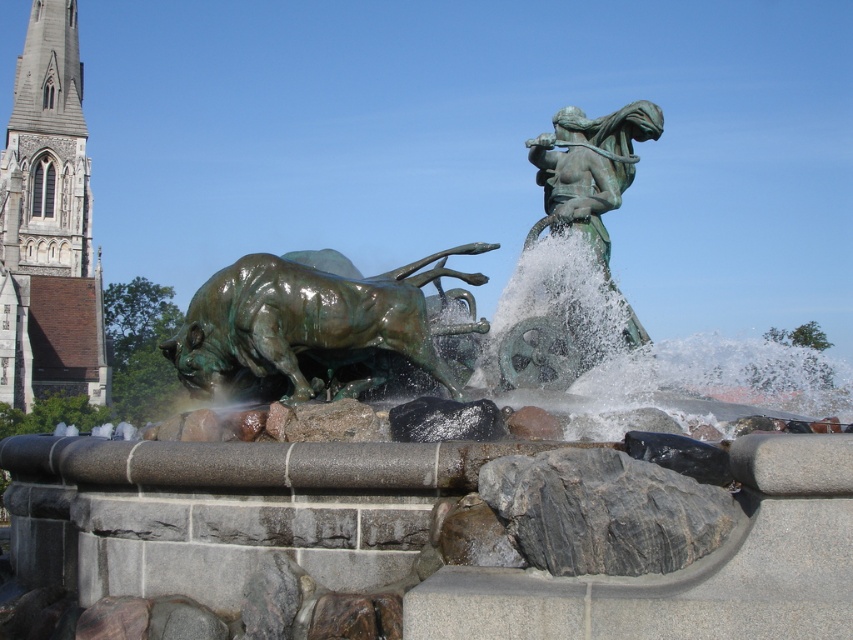
You are a tourist standing in front of the fountain sculpture. You want to take a photo that includes both the stone tower at left and the bronze statue at upper right. Which object should you focus on first to ensure both are in frame?

The stone tower at left is taller than the bronze statue at upper right, so you should focus on the stone tower at left first to ensure both are in frame.